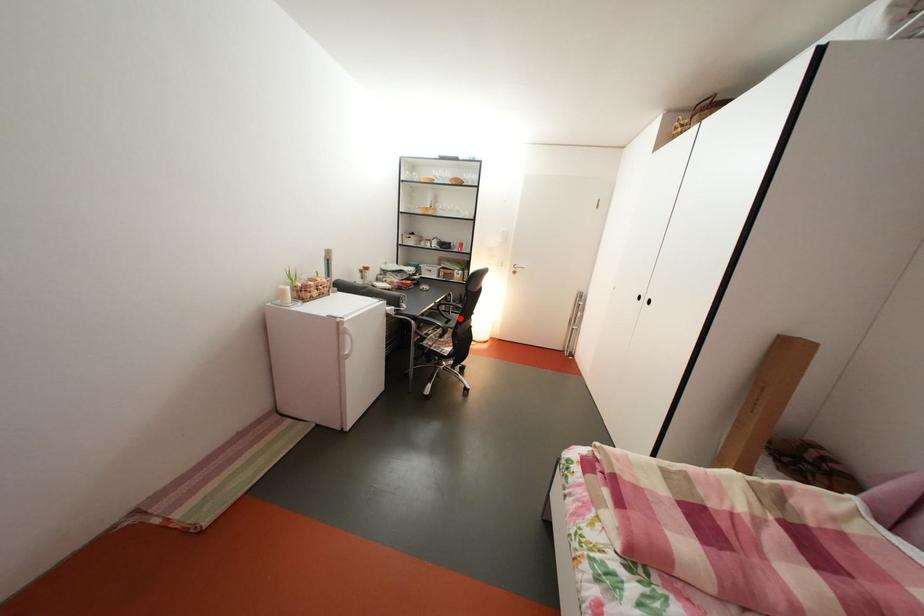
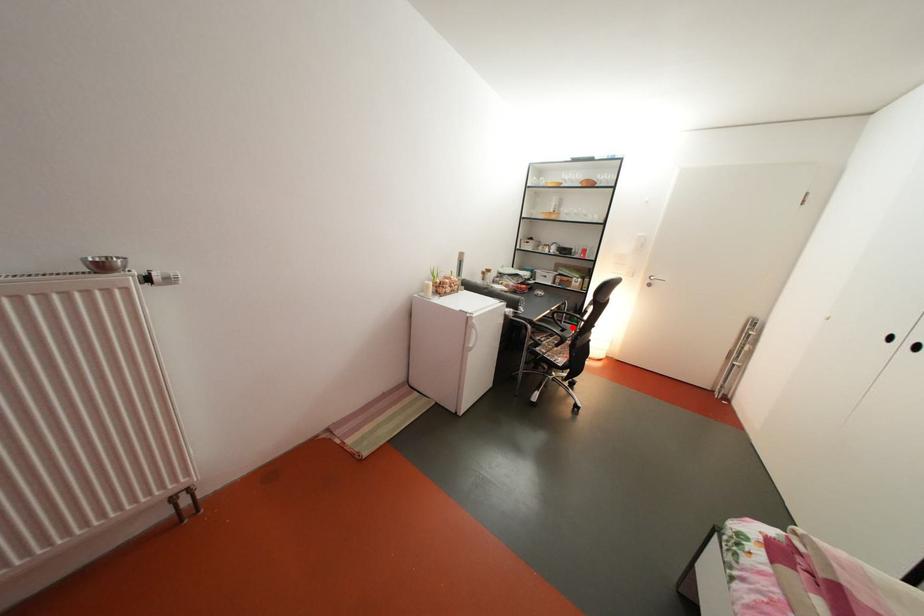
Based on the photo, I am providing you with two images of the same scene from different viewpoints. A red point is marked on the first image and another point is marked on the second image. Is the red point in image1 aligned with the point shown in image2?

Yes